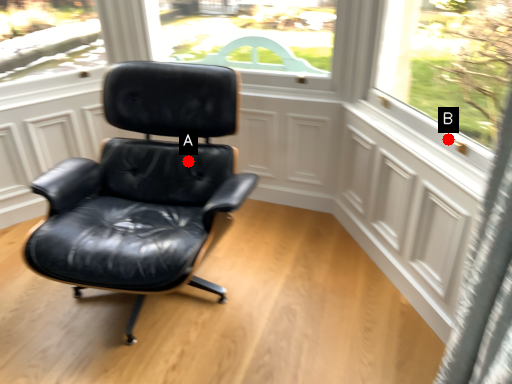
Question: Two points are circled on the image, labeled by A and B beside each circle. Among these points, which one is nearest to the camera?

Choices:
 (A) A is closer
 (B) B is closer

Answer: (B)